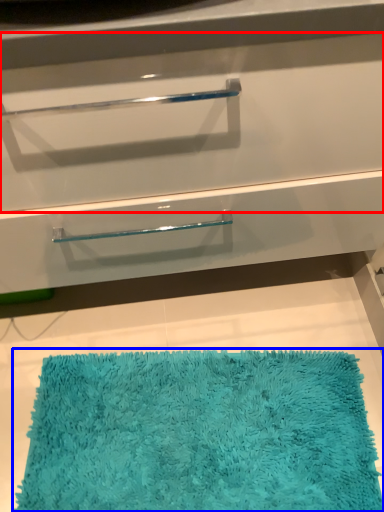
Question: Which point is further to the camera, drawer (highlighted by a red box) or bath mat (highlighted by a blue box)?

Choices:
 (A) drawer
 (B) bath mat

Answer: (B)